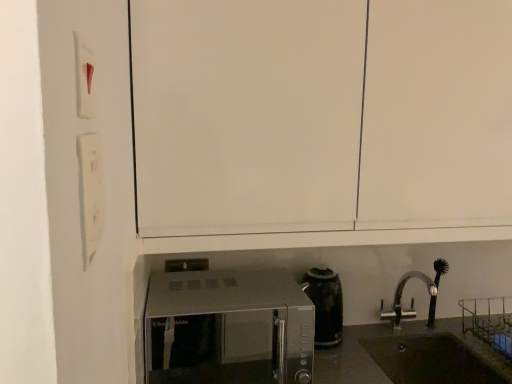
The image size is (512, 384). What do you see at coordinates (228, 329) in the screenshot?
I see `satin silver microwave at lower center` at bounding box center [228, 329].

Describe the element at coordinates (84, 79) in the screenshot. I see `white plastic light switch at upper left, placed as the second light switch when sorted from bottom to top` at that location.

Where is `black matte sink at lower right`? Image resolution: width=512 pixels, height=384 pixels. black matte sink at lower right is located at coordinates (392, 352).

The image size is (512, 384). I want to click on black glossy coffee pot at center, so [325, 305].

Measure the distance between point (307, 293) and camera.

The distance of point (307, 293) from camera is 1.43 meters.

I want to click on satin silver microwave at lower center, so click(x=228, y=329).

Can you tell me how much black glossy coffee pot at center and satin silver microwave at lower center differ in facing direction?

The angle between the facing direction of black glossy coffee pot at center and the facing direction of satin silver microwave at lower center is 2.37 degrees.

From the image's perspective, relative to satin silver microwave at lower center, is black glossy coffee pot at center above or below?

From the image's perspective, black glossy coffee pot at center appears above satin silver microwave at lower center.

Is black glossy coffee pot at center not close to satin silver microwave at lower center?

Yes, black glossy coffee pot at center is far from satin silver microwave at lower center.

Could you tell me if black glossy coffee pot at center is facing satin silver microwave at lower center?

No, black glossy coffee pot at center is not facing towards satin silver microwave at lower center.

Is black matte sink at lower right facing away from satin silver microwave at lower center?

No, black matte sink at lower right is not facing the opposite direction of satin silver microwave at lower center.

Considering the sizes of objects black matte sink at lower right and satin silver microwave at lower center in the image provided, who is wider, black matte sink at lower right or satin silver microwave at lower center?

satin silver microwave at lower center.

Can we say black matte sink at lower right lies outside satin silver microwave at lower center?

That's correct, black matte sink at lower right is outside of satin silver microwave at lower center.

Considering the positions of point (339, 26) and point (319, 279), is point (339, 26) closer or farther from the camera than point (319, 279)?

Point (339, 26) appears to be closer to the viewer than point (319, 279).

From the picture: Does white matte cabinet at upper center have a smaller size compared to black glossy coffee pot at center?

No.

Consider the image. Who is taller, white matte cabinet at upper center or black glossy coffee pot at center?

white matte cabinet at upper center is taller.

Does white matte light switch at left, which is counted as the first light switch, starting from the bottom, have a greater width compared to black matte sink at lower right?

Incorrect, the width of white matte light switch at left, which is counted as the first light switch, starting from the bottom, does not surpass that of black matte sink at lower right.

Is white matte light switch at left, which is counted as the first light switch, starting from the bottom, at the left side of black matte sink at lower right?

Indeed, white matte light switch at left, which is counted as the first light switch, starting from the bottom, is positioned on the left side of black matte sink at lower right.

Is white matte light switch at left, which is counted as the first light switch, starting from the bottom, further to camera compared to black matte sink at lower right?

No, white matte light switch at left, which is counted as the first light switch, starting from the bottom, is closer to the camera.

Which object is thinner, satin silver microwave at lower center or black matte sink at lower right?

black matte sink at lower right.

Considering the points (298, 292) and (396, 337), which point is in front, point (298, 292) or point (396, 337)?

Positioned in front is point (298, 292).

Is satin silver microwave at lower center not near black matte sink at lower right?

satin silver microwave at lower center is positioned a significant distance from black matte sink at lower right.

Where is `counter top below the satin silver microwave at lower center (from the image's perspective)`? counter top below the satin silver microwave at lower center (from the image's perspective) is located at coordinates (392, 352).

Between white matte light switch at left, which is counted as the first light switch, starting from the bottom, and black glossy coffee pot at center, which one has more height?

Standing taller between the two is black glossy coffee pot at center.

Measure the distance between white matte light switch at left, the 2th light switch in the top-to-bottom sequence, and black glossy coffee pot at center.

white matte light switch at left, the 2th light switch in the top-to-bottom sequence, and black glossy coffee pot at center are 1.02 meters apart.

Which is closer to the camera, (94, 146) or (312, 280)?

The point (94, 146) is in front.

From the image's perspective, which object appears higher, white matte light switch at left, the 2th light switch in the top-to-bottom sequence, or black glossy coffee pot at center?

white matte light switch at left, the 2th light switch in the top-to-bottom sequence, is shown above in the image.

Is black matte sink at lower right smaller than black glossy coffee pot at center?

Actually, black matte sink at lower right might be larger than black glossy coffee pot at center.

From the image's perspective, who appears lower, black matte sink at lower right or black glossy coffee pot at center?

black matte sink at lower right, from the image's perspective.

Is black matte sink at lower right positioned with its back to black glossy coffee pot at center?

That's not correct — black matte sink at lower right is not looking away from black glossy coffee pot at center.

Identify the location of microwave oven above the black glossy coffee pot at center (from a real-world perspective). The image size is (512, 384). (228, 329).

Where is `counter top on the right of satin silver microwave at lower center`? counter top on the right of satin silver microwave at lower center is located at coordinates (392, 352).

In the scene shown: Considering their positions, is white matte cabinet at upper center positioned closer to satin silver microwave at lower center than black glossy coffee pot at center?

Based on the image, black glossy coffee pot at center appears to be nearer to satin silver microwave at lower center.

Based on their spatial positions, is white plastic light switch at upper left, the 1th light switch from the top, or white matte cabinet at upper center further from satin silver microwave at lower center?

Among the two, white plastic light switch at upper left, the 1th light switch from the top, is located further to satin silver microwave at lower center.

From the image, which object appears to be nearer to satin silver microwave at lower center, black glossy coffee pot at center or white matte cabinet at upper center?

black glossy coffee pot at center lies closer to satin silver microwave at lower center than the other object.

Which object lies further to the anchor point black glossy coffee pot at center, white matte cabinet at upper center or white plastic light switch at upper left, placed as the second light switch when sorted from bottom to top?

white plastic light switch at upper left, placed as the second light switch when sorted from bottom to top, lies further to black glossy coffee pot at center than the other object.

Which object lies nearer to the anchor point white plastic light switch at upper left, placed as the second light switch when sorted from bottom to top, black glossy coffee pot at center or satin silver microwave at lower center?

Based on the image, black glossy coffee pot at center appears to be nearer to white plastic light switch at upper left, placed as the second light switch when sorted from bottom to top.

From the image, which object appears to be nearer to black glossy coffee pot at center, white plastic light switch at upper left, placed as the second light switch when sorted from bottom to top, or white matte cabinet at upper center?

white matte cabinet at upper center is closer to black glossy coffee pot at center.

From the image, which object appears to be nearer to white matte cabinet at upper center, black matte sink at lower right or black glossy coffee pot at center?

Based on the image, black glossy coffee pot at center appears to be nearer to white matte cabinet at upper center.

Which object lies further to the anchor point white plastic light switch at upper left, the 1th light switch from the top, white matte cabinet at upper center or black glossy coffee pot at center?

black glossy coffee pot at center is further to white plastic light switch at upper left, the 1th light switch from the top.

Locate an element on the screen. microwave oven between white matte light switch at left, the 2th light switch in the top-to-bottom sequence, and black glossy coffee pot at center, along the z-axis is located at coordinates (228, 329).

The image size is (512, 384). I want to click on cabinetry between white plastic light switch at upper left, the 1th light switch from the top, and black glossy coffee pot at center in the front-back direction, so click(321, 115).

Where is `light switch located between white plastic light switch at upper left, placed as the second light switch when sorted from bottom to top, and satin silver microwave at lower center in the depth direction`? The image size is (512, 384). light switch located between white plastic light switch at upper left, placed as the second light switch when sorted from bottom to top, and satin silver microwave at lower center in the depth direction is located at coordinates (90, 193).

Find the location of `coffeepot situated between satin silver microwave at lower center and black matte sink at lower right from left to right`. coffeepot situated between satin silver microwave at lower center and black matte sink at lower right from left to right is located at coordinates (325, 305).